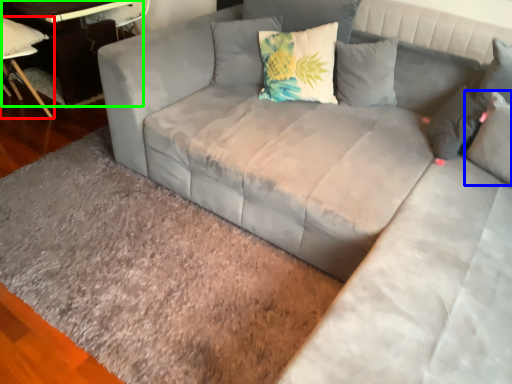
Question: Which object is the closest to the chair (highlighted by a red box)? Choose among these: pillow (highlighted by a blue box) or table (highlighted by a green box).

Choices:
 (A) pillow
 (B) table

Answer: (B)